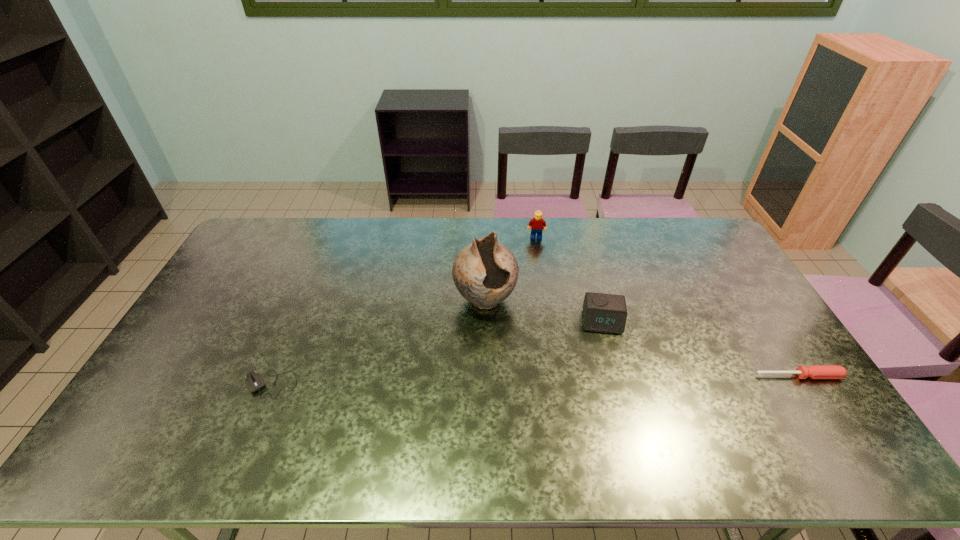
Where is `vacant space situated on the right of the computer mouse`? The width and height of the screenshot is (960, 540). vacant space situated on the right of the computer mouse is located at coordinates (392, 384).

Identify the location of vacant area situated 0.130m at the tip of the second shortest object. (829, 424).

This screenshot has height=540, width=960. Find the location of `vacant position located on the front-facing side of the Lego`. vacant position located on the front-facing side of the Lego is located at coordinates (539, 284).

What are the coordinates of `vacant space positioned 0.080m on the front-facing side of the Lego` in the screenshot? It's located at (537, 253).

Locate an element on the screen. The height and width of the screenshot is (540, 960). vacant region located 0.210m on the front-facing side of the Lego is located at coordinates (538, 276).

You are a GUI agent. You are given a task and a screenshot of the screen. Output one action in this format:
    pyautogui.click(x=<x>, y=<y>)
    Task: Click on the vacant space located 0.050m from the spout of the pottery
    
    Given the screenshot: What is the action you would take?
    pyautogui.click(x=501, y=334)

I want to click on blank area located 0.080m from the spout of the pottery, so click(x=505, y=341).

Image resolution: width=960 pixels, height=540 pixels. Find the location of `free space located 0.180m from the spout of the pottery`. free space located 0.180m from the spout of the pottery is located at coordinates (517, 367).

Locate an element on the screen. This screenshot has width=960, height=540. vacant point located 0.240m on the front-facing side of the third tallest object is located at coordinates (610, 403).

The height and width of the screenshot is (540, 960). In order to click on vacant space located on the front-facing side of the third tallest object in this screenshot , I will do `click(606, 367)`.